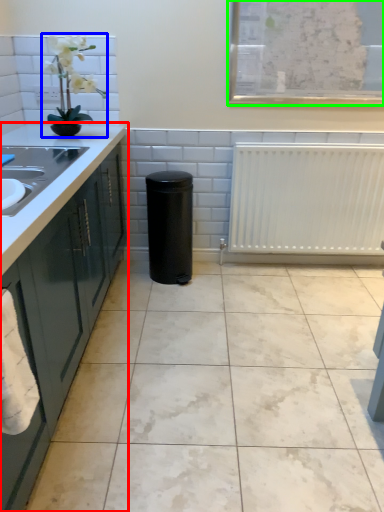
Question: Which object is positioned farthest from countertop (highlighted by a red box)? Select from houseplant (highlighted by a blue box) and window screen (highlighted by a green box).

Choices:
 (A) houseplant
 (B) window screen

Answer: (B)